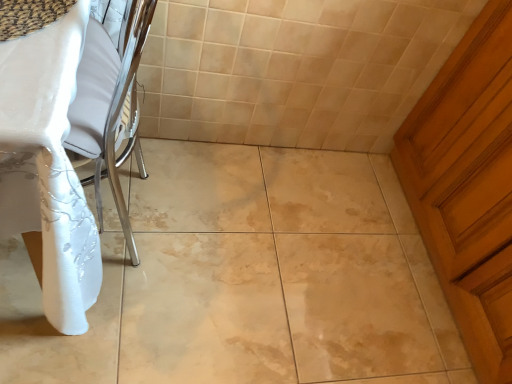
At what (x,y) coordinates should I click in order to perform the action: click on vacant area located to the right-hand side of white glossy table at left. Please return your answer as a coordinate pair (x, y). This screenshot has height=384, width=512. Looking at the image, I should click on (215, 273).